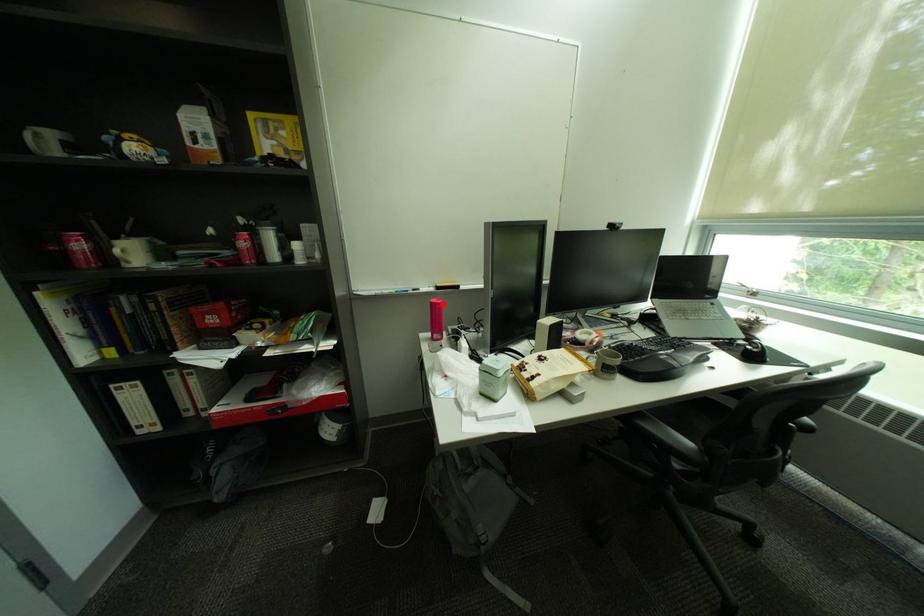
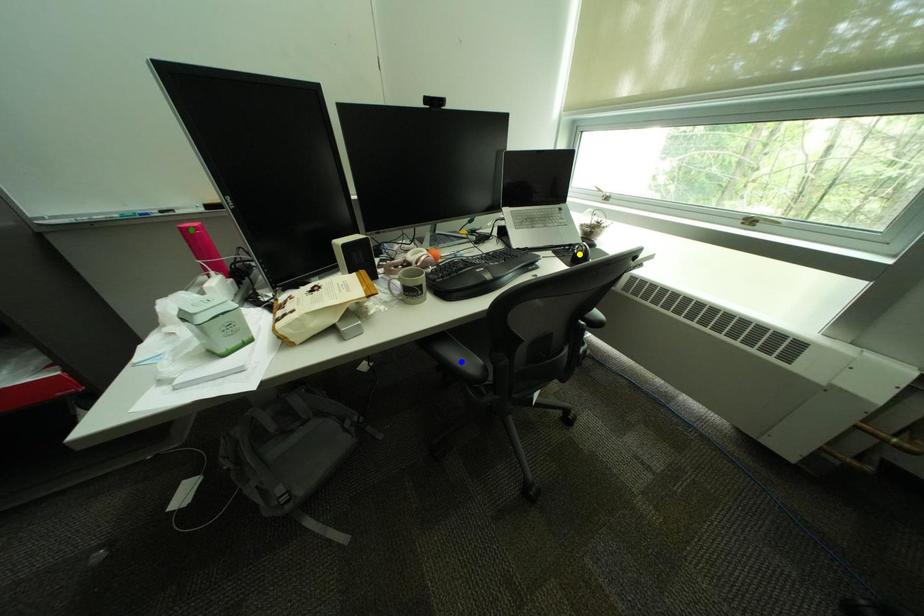
Question: I am providing you with two images of the same scene from different viewpoints. A red point is marked on the first image. You are given multiple points on the second image. Which spot in image 2 lines up with the point in image 1?

Choices:
 (A) green point
 (B) yellow point
 (C) blue point

Answer: (A)